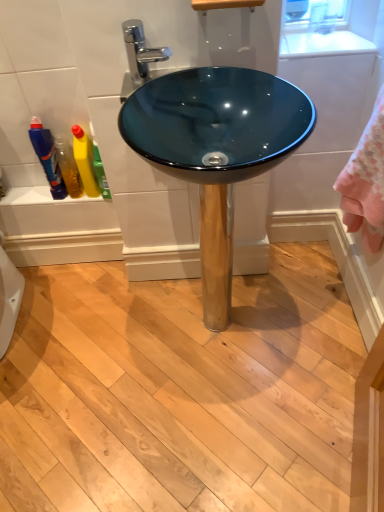
Question: Can you confirm if teal glass bowl at center is bigger than chrome metallic faucet at upper center?

Choices:
 (A) no
 (B) yes

Answer: (B)

Question: Does teal glass bowl at center appear on the left side of chrome metallic faucet at upper center?

Choices:
 (A) yes
 (B) no

Answer: (B)

Question: Does teal glass bowl at center have a lesser width compared to chrome metallic faucet at upper center?

Choices:
 (A) yes
 (B) no

Answer: (B)

Question: Is teal glass bowl at center facing towards chrome metallic faucet at upper center?

Choices:
 (A) no
 (B) yes

Answer: (A)

Question: From a real-world perspective, is teal glass bowl at center over chrome metallic faucet at upper center?

Choices:
 (A) yes
 (B) no

Answer: (B)

Question: From the image's perspective, relative to translucent plastic bottle at left, is translucent plastic bottles at left above or below?

Choices:
 (A) above
 (B) below

Answer: (B)

Question: In the image, is translucent plastic bottles at left positioned in front of or behind translucent plastic bottle at left?

Choices:
 (A) front
 (B) behind

Answer: (B)

Question: Considering the positions of translucent plastic bottles at left and translucent plastic bottle at left in the image, is translucent plastic bottles at left wider or thinner than translucent plastic bottle at left?

Choices:
 (A) wide
 (B) thin

Answer: (B)

Question: Is point (79, 193) closer or farther from the camera than point (51, 193)?

Choices:
 (A) closer
 (B) farther

Answer: (B)

Question: Is white glossy countertop at upper center bigger or smaller than glossy glass bowl at center?

Choices:
 (A) small
 (B) big

Answer: (A)

Question: Is point (360, 49) positioned closer to the camera than point (304, 53)?

Choices:
 (A) farther
 (B) closer

Answer: (B)

Question: From the image's perspective, is white glossy countertop at upper center located above or below glossy glass bowl at center?

Choices:
 (A) above
 (B) below

Answer: (A)

Question: Considering the positions of white glossy countertop at upper center and glossy glass bowl at center in the image, is white glossy countertop at upper center taller or shorter than glossy glass bowl at center?

Choices:
 (A) tall
 (B) short

Answer: (B)

Question: In terms of height, does yellow liquid at left, arranged as the second cleaning product when viewed from the left, look taller or shorter compared to glossy glass bowl at center?

Choices:
 (A) tall
 (B) short

Answer: (B)

Question: Relative to glossy glass bowl at center, is yellow liquid at left, arranged as the second cleaning product when viewed from the left, in front or behind?

Choices:
 (A) front
 (B) behind

Answer: (B)